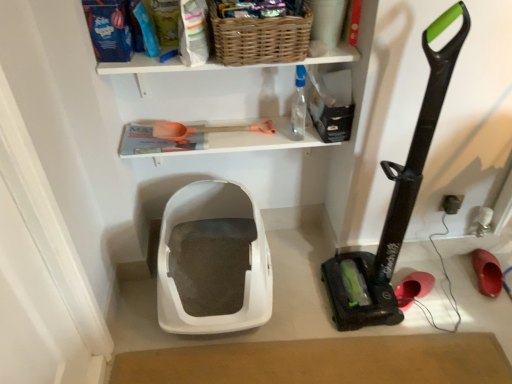
Identify the location of vacant area that lies between rubberized red shoe at lower right, the first footwear from the left, and rubber matte shoe at lower right, the second footwear positioned from the left. Image resolution: width=512 pixels, height=384 pixels. (451, 278).